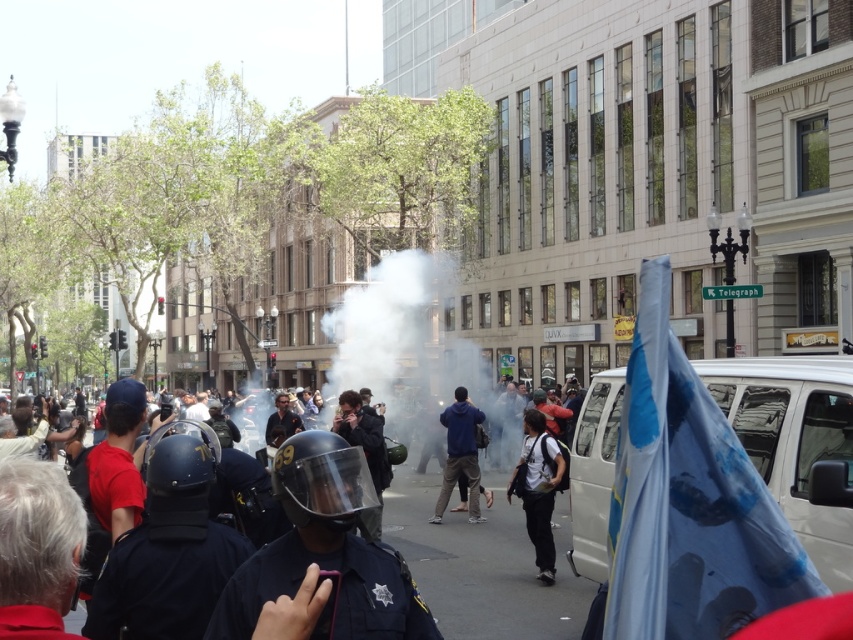
Question: Does shiny black helmet at center appear on the right side of blue fleece jacket at center?

Choices:
 (A) no
 (B) yes

Answer: (A)

Question: Is shiny black helmet at center smaller than matte black helmet at center?

Choices:
 (A) no
 (B) yes

Answer: (B)

Question: Observing the image, what is the correct spatial positioning of shiny black helmet at center in reference to white matte backpack at center?

Choices:
 (A) left
 (B) right

Answer: (A)

Question: Which of the following is the farthest from the observer?

Choices:
 (A) (468, 474)
 (B) (276, 458)
 (C) (527, 532)
 (D) (426, 588)

Answer: (A)

Question: Which is nearer to the blue fleece jacket at center?

Choices:
 (A) matte black helmet at center
 (B) shiny black helmet at center
 (C) white matte backpack at center

Answer: (A)

Question: Among these objects, which one is farthest from the camera?

Choices:
 (A) white matte backpack at center
 (B) blue fleece jacket at center
 (C) matte black helmet at center

Answer: (B)